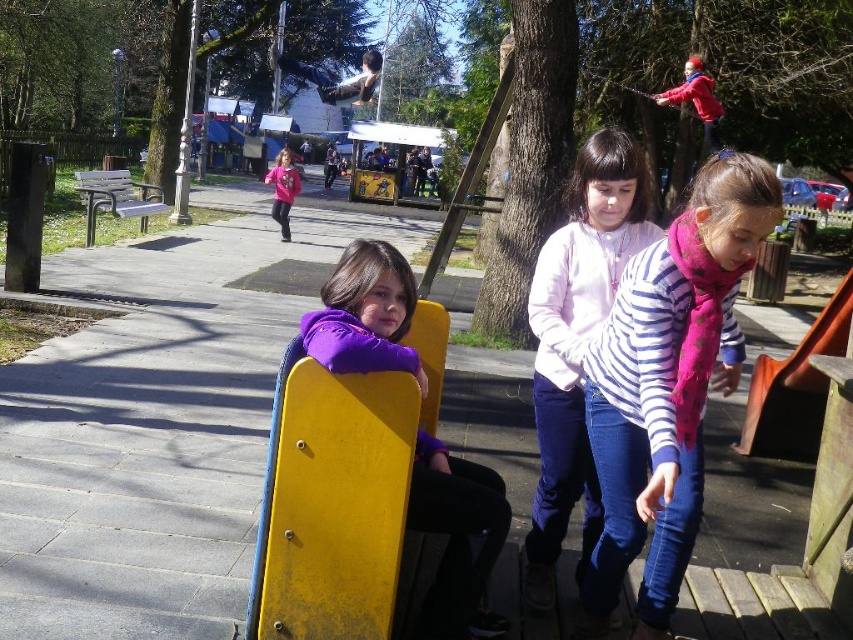
You are a photographer trying to capture a candid shot of the striped cotton shirt at center and the pink fabric shirt at center. Which one is positioned lower in the image?

The striped cotton shirt at center is positioned below the pink fabric shirt at center, so it is lower in the image.